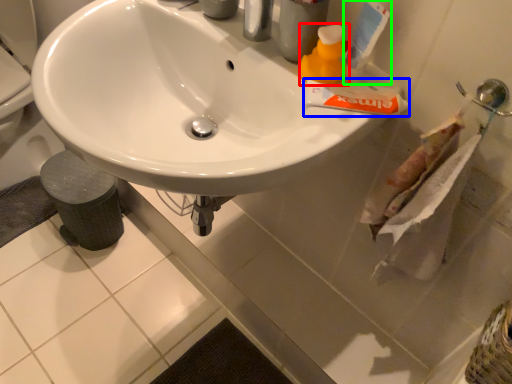
Question: Based on their relative distances, which object is farther from cleaning product (highlighted by a red box)? Choose from toothpaste (highlighted by a blue box) and toothpaste (highlighted by a green box).

Choices:
 (A) toothpaste
 (B) toothpaste

Answer: (A)